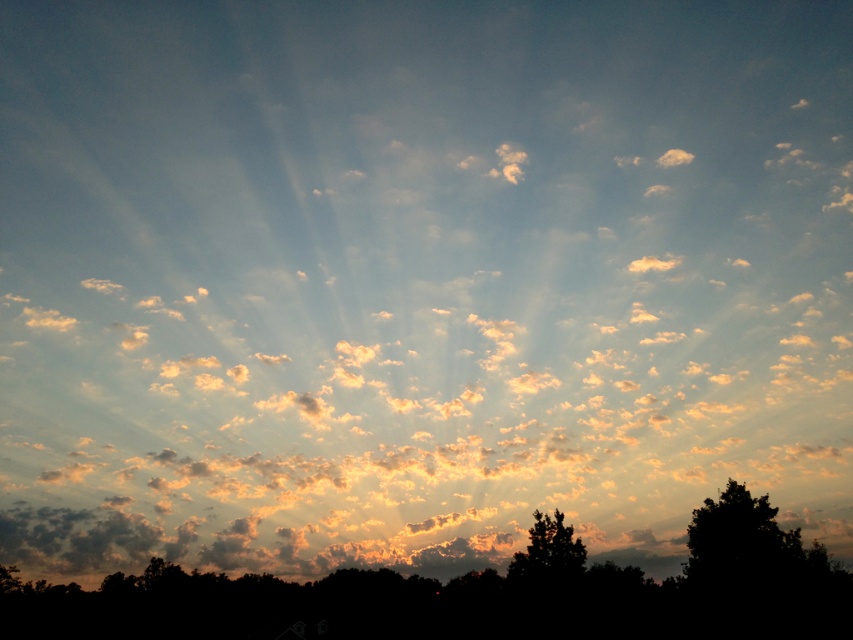
You are standing in a field and see two silhouette trees in the distance. The silhouette tree at lower center and the silhouette tree at lower right. Which one is more to the left?

The silhouette tree at lower center is more to the left because it is positioned on the left side of the silhouette tree at lower right.

You are standing at the center of the image and want to locate the silhouette tree at lower center. According to the coordinates provided, where exactly is it positioned?

The silhouette tree at lower center is located at point 0.928 on the x axis and 0.560 on the y axis.